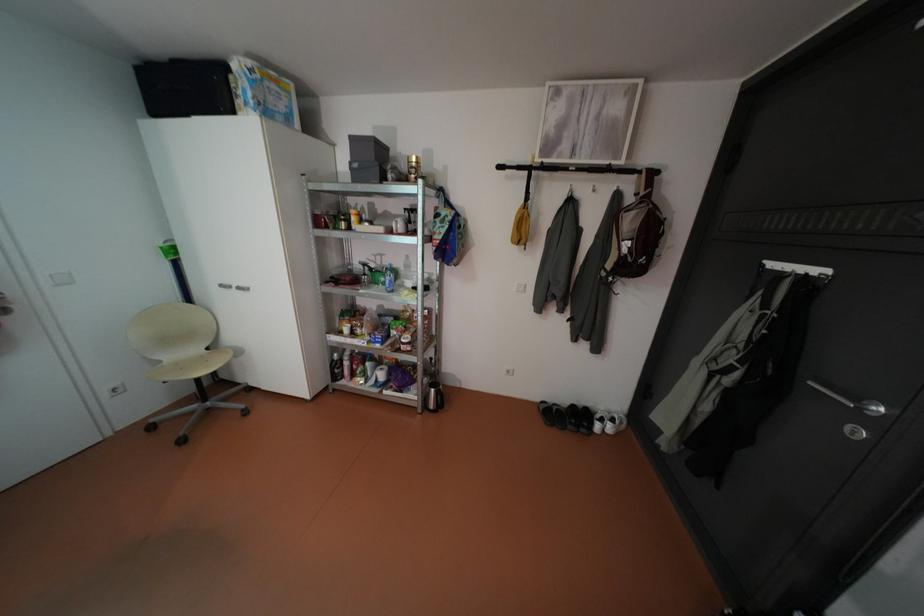
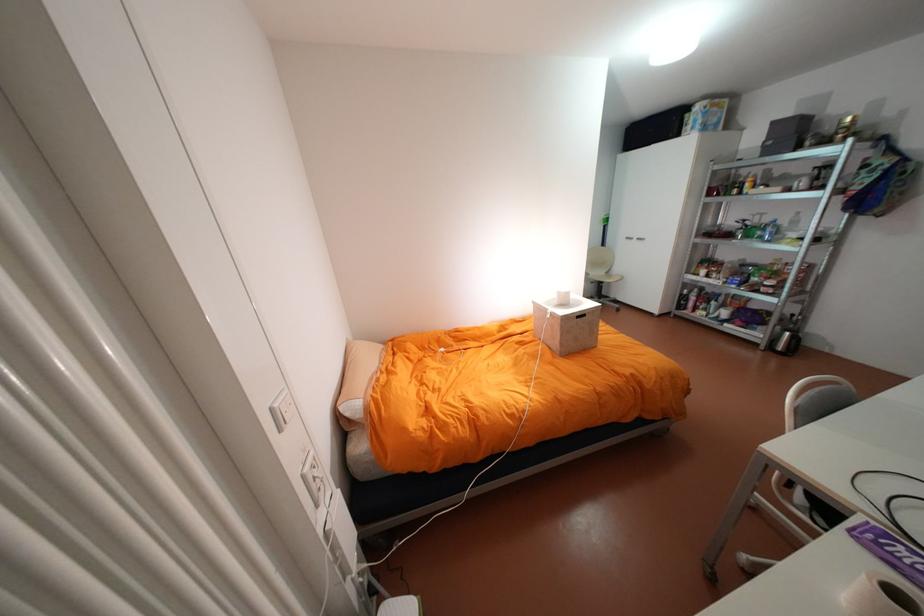
Find the pixel in the second image that matches pixel 232 285 in the first image.

(636, 237)